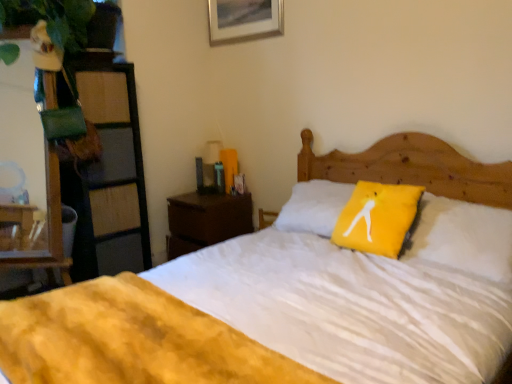
Question: From a real-world perspective, does white soft bed at center sit lower than brown wood nightstand at center?

Choices:
 (A) yes
 (B) no

Answer: (B)

Question: From a real-world perspective, is white soft bed at center on brown wood nightstand at center?

Choices:
 (A) yes
 (B) no

Answer: (A)

Question: Does white soft bed at center come in front of brown wood nightstand at center?

Choices:
 (A) no
 (B) yes

Answer: (B)

Question: Could brown wood nightstand at center be considered to be inside white soft bed at center?

Choices:
 (A) no
 (B) yes

Answer: (A)

Question: Is white soft bed at center shorter than brown wood nightstand at center?

Choices:
 (A) no
 (B) yes

Answer: (A)

Question: From their relative heights in the image, would you say brown wood nightstand at center is taller or shorter than metallic silver picture frame at upper center?

Choices:
 (A) tall
 (B) short

Answer: (A)

Question: Is brown wood nightstand at center wider or thinner than metallic silver picture frame at upper center?

Choices:
 (A) wide
 (B) thin

Answer: (A)

Question: Relative to metallic silver picture frame at upper center, is brown wood nightstand at center in front or behind?

Choices:
 (A) behind
 (B) front

Answer: (A)

Question: Based on their sizes in the image, would you say brown wood nightstand at center is bigger or smaller than metallic silver picture frame at upper center?

Choices:
 (A) big
 (B) small

Answer: (A)

Question: In terms of width, does metallic silver picture frame at upper center look wider or thinner when compared to brown wood nightstand at center?

Choices:
 (A) thin
 (B) wide

Answer: (A)

Question: From a real-world perspective, is metallic silver picture frame at upper center physically located above or below brown wood nightstand at center?

Choices:
 (A) below
 (B) above

Answer: (B)

Question: Considering the positions of metallic silver picture frame at upper center and brown wood nightstand at center in the image, is metallic silver picture frame at upper center bigger or smaller than brown wood nightstand at center?

Choices:
 (A) big
 (B) small

Answer: (B)

Question: From the image's perspective, is metallic silver picture frame at upper center located above or below brown wood nightstand at center?

Choices:
 (A) below
 (B) above

Answer: (B)

Question: Would you say white soft bed at center is inside or outside brown wood nightstand at center?

Choices:
 (A) inside
 (B) outside

Answer: (B)

Question: Is point (74, 365) positioned closer to the camera than point (231, 216)?

Choices:
 (A) closer
 (B) farther

Answer: (A)